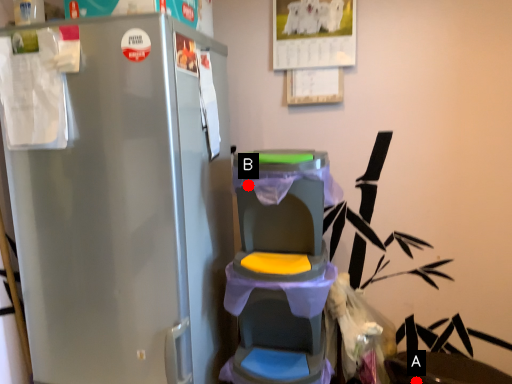
Question: Two points are circled on the image, labeled by A and B beside each circle. Which point appears farthest from the camera in this image?

Choices:
 (A) A is further
 (B) B is further

Answer: (A)